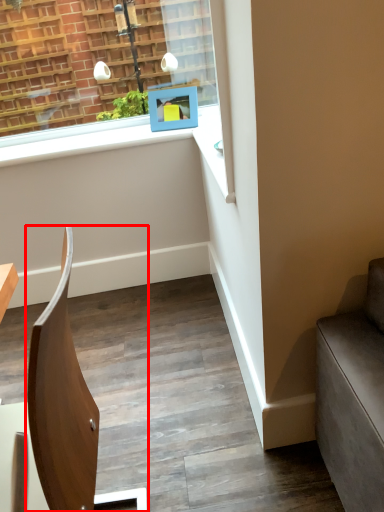
Question: From the image's perspective, what is the correct spatial positioning of chair (annotated by the red box) in reference to picture frame?

Choices:
 (A) below
 (B) above

Answer: (A)